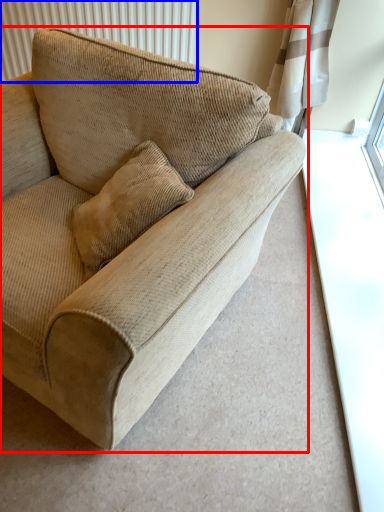
Question: Which point is further to the camera, studio couch (highlighted by a red box) or radiator (highlighted by a blue box)?

Choices:
 (A) studio couch
 (B) radiator

Answer: (B)